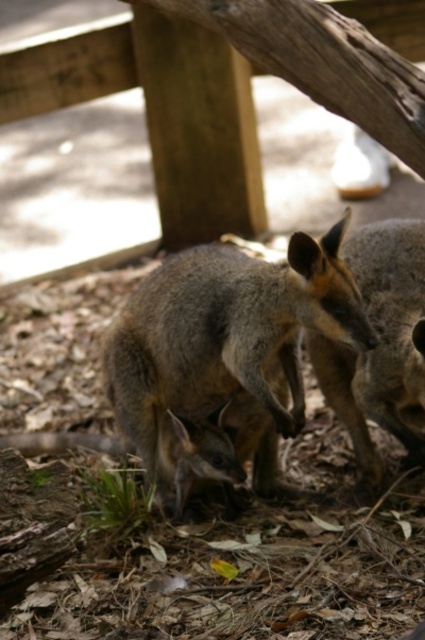
Which is above, gray fur kangaroo at center or brown fur kangaroo at center?

Positioned higher is brown fur kangaroo at center.

Who is lower down, gray fur kangaroo at center or brown fur kangaroo at center?

gray fur kangaroo at center is below.

Measure the distance between point (240, 451) and camera.

7.91 feet

Locate an element on the screen. This screenshot has width=425, height=640. gray fur kangaroo at center is located at coordinates (226, 346).